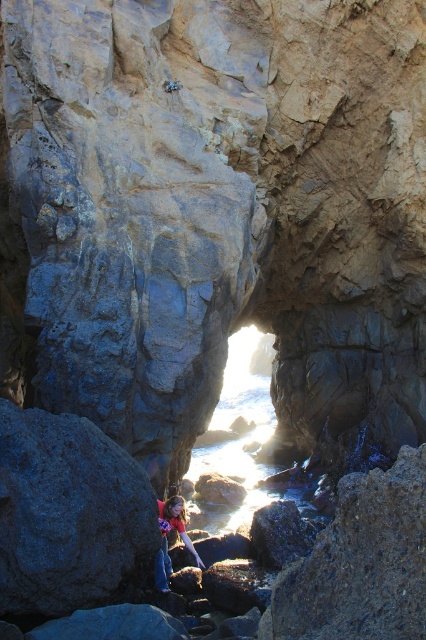
Does translucent water at center have a larger size compared to matte red shirt at lower center?

Correct, translucent water at center is larger in size than matte red shirt at lower center.

Where is `translucent water at center`? The width and height of the screenshot is (426, 640). translucent water at center is located at coordinates (238, 436).